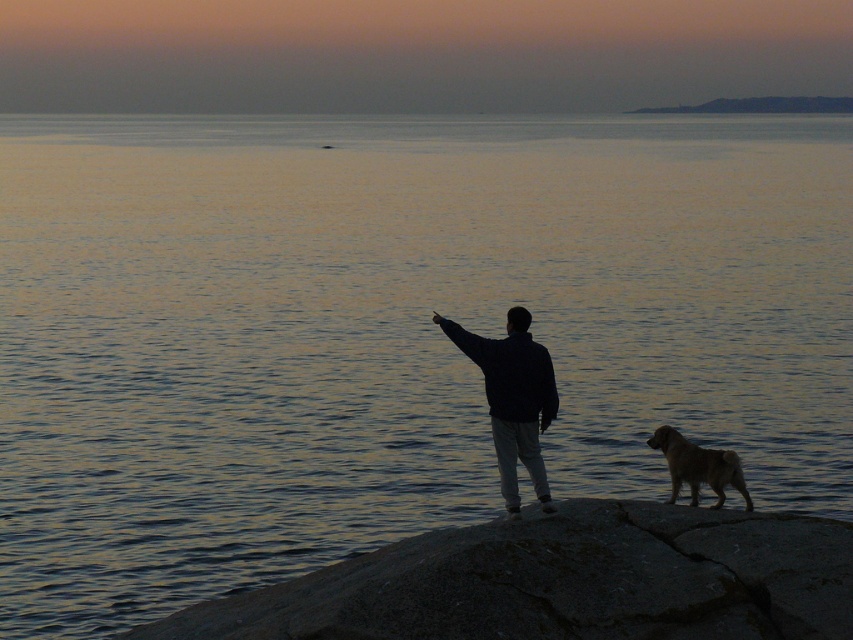
Question: Does black matte jacket at center appear on the right side of golden fur dog at lower right?

Choices:
 (A) yes
 (B) no

Answer: (B)

Question: Which object appears farthest from the camera in this image?

Choices:
 (A) black matte jacket at center
 (B) golden fur dog at lower right

Answer: (B)

Question: Which point is farther from the camera taking this photo?

Choices:
 (A) tap(506, 320)
 (B) tap(225, 49)
 (C) tap(744, 524)

Answer: (B)

Question: Which object is the farthest from the black matte jacket at center?

Choices:
 (A) smooth orange sky at upper center
 (B) golden fur dog at lower right
 (C) gray rough rock at lower center

Answer: (A)

Question: Is gray rough rock at lower center below golden fur dog at lower right?

Choices:
 (A) yes
 (B) no

Answer: (A)

Question: Does smooth orange sky at upper center appear on the left side of gray rough rock at lower center?

Choices:
 (A) no
 (B) yes

Answer: (B)